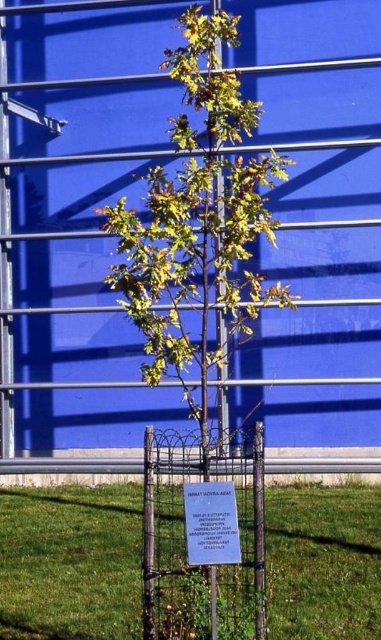
Question: Which object appears closest to the camera in this image?

Choices:
 (A) green leafy tree at center
 (B) white paper sign at center
 (C) green grass at lower center
 (D) wire mesh fence at lower center

Answer: (B)

Question: Can you confirm if blue matte garage door at center is positioned below wire mesh fence at lower center?

Choices:
 (A) no
 (B) yes

Answer: (A)

Question: Observing the image, what is the correct spatial positioning of blue matte garage door at center in reference to green grass at lower center?

Choices:
 (A) above
 (B) below

Answer: (A)

Question: Can you confirm if green grass at lower center is positioned above wire mesh fence at lower center?

Choices:
 (A) no
 (B) yes

Answer: (A)

Question: Which point is closer to the camera taking this photo?

Choices:
 (A) (3, 138)
 (B) (209, 508)
 (C) (222, 196)
 (D) (59, 636)

Answer: (B)

Question: Which is farther from the green leafy tree at center?

Choices:
 (A) wire mesh fence at lower center
 (B) green grass at lower center

Answer: (B)